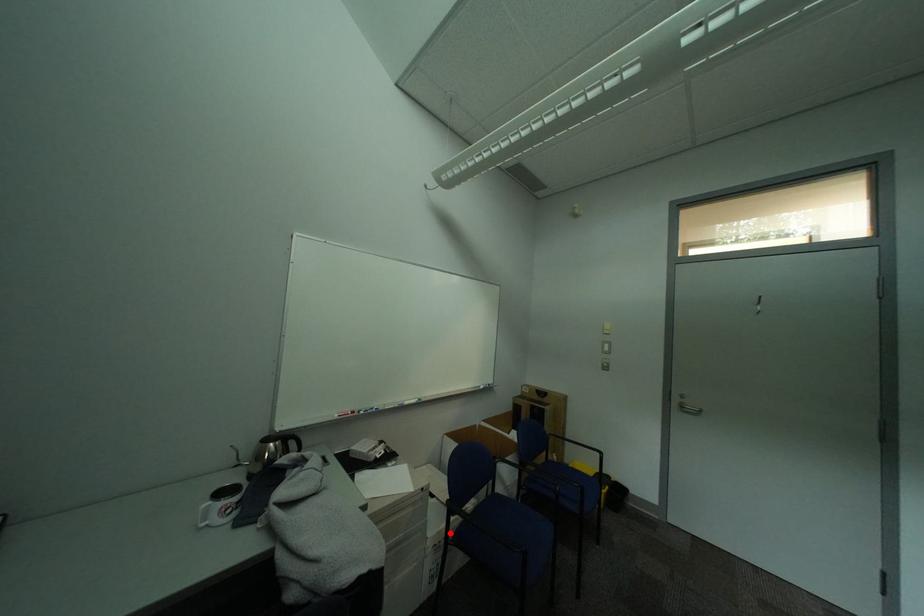
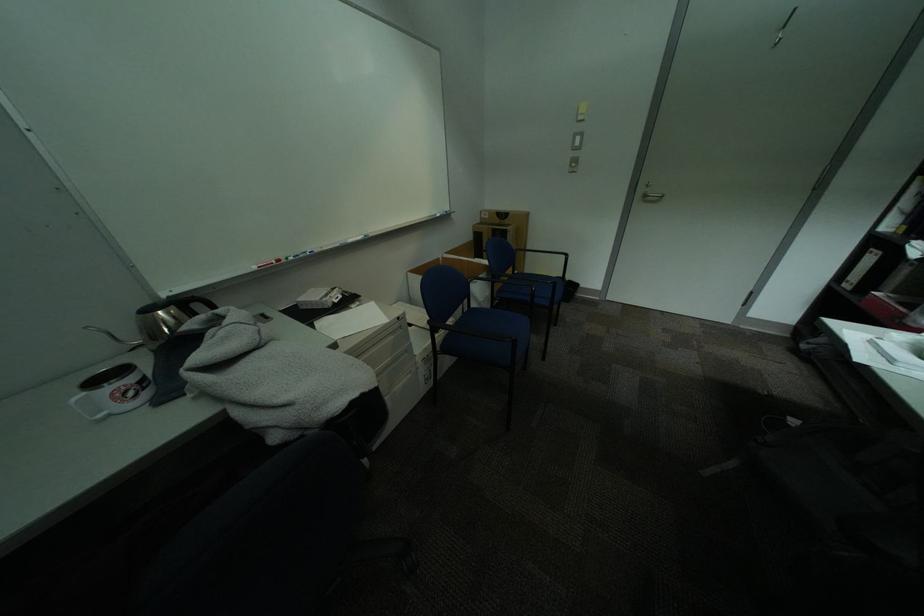
Locate, in the second image, the point that corresponds to the highlighted location in the first image.

(435, 350)